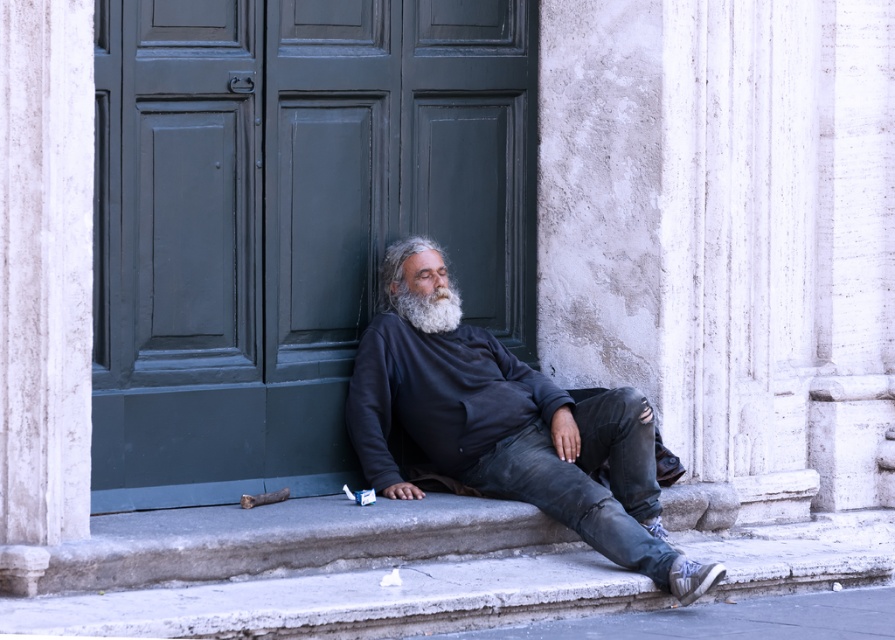
You are an architect analyzing the proportions of the building entrance. Given the green matte door at center and the white matte beard at center, which object occupies more space in the scene?

The green matte door at center has a larger size compared to the white matte beard at center, so it occupies more space in the scene.